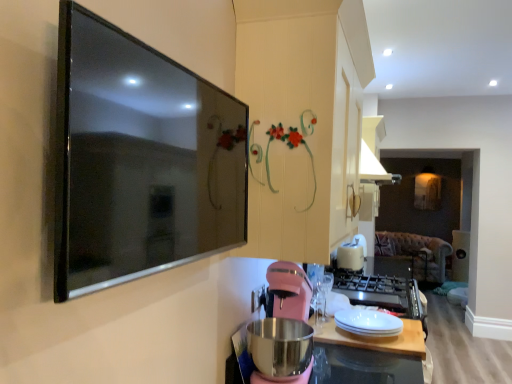
Question: Is pink matte blender at lower center positioned behind black glossy tv at upper left?

Choices:
 (A) no
 (B) yes

Answer: (B)

Question: Does pink matte blender at lower center appear on the right side of black glossy tv at upper left?

Choices:
 (A) no
 (B) yes

Answer: (B)

Question: From the image's perspective, does pink matte blender at lower center appear higher than black glossy tv at upper left?

Choices:
 (A) no
 (B) yes

Answer: (A)

Question: Does pink matte blender at lower center contain black glossy tv at upper left?

Choices:
 (A) no
 (B) yes

Answer: (A)

Question: From a real-world perspective, is pink matte blender at lower center under black glossy tv at upper left?

Choices:
 (A) yes
 (B) no

Answer: (A)

Question: Considering the positions of point (380, 344) and point (355, 322), is point (380, 344) closer or farther from the camera than point (355, 322)?

Choices:
 (A) farther
 (B) closer

Answer: (B)

Question: From the image's perspective, is white matte wood at center positioned above or below white glossy plate at center?

Choices:
 (A) above
 (B) below

Answer: (B)

Question: Considering their positions, is white matte wood at center located in front of or behind white glossy plate at center?

Choices:
 (A) behind
 (B) front

Answer: (B)

Question: Considering the relative positions of white matte wood at center and white glossy plate at center in the image provided, is white matte wood at center to the left or to the right of white glossy plate at center?

Choices:
 (A) left
 (B) right

Answer: (B)

Question: From the image's perspective, is metallic stainless steel at lower center located above or below white plastic toaster at upper center?

Choices:
 (A) above
 (B) below

Answer: (B)

Question: Considering the positions of metallic stainless steel at lower center and white plastic toaster at upper center in the image, is metallic stainless steel at lower center bigger or smaller than white plastic toaster at upper center?

Choices:
 (A) small
 (B) big

Answer: (B)

Question: In the image, is metallic stainless steel at lower center on the left side or the right side of white plastic toaster at upper center?

Choices:
 (A) left
 (B) right

Answer: (A)

Question: Considering their positions, is metallic stainless steel at lower center located in front of or behind white plastic toaster at upper center?

Choices:
 (A) behind
 (B) front

Answer: (B)

Question: Is pink matte blender at lower center wider or thinner than white glossy plate at center?

Choices:
 (A) thin
 (B) wide

Answer: (B)

Question: Considering the positions of pink matte blender at lower center and white glossy plate at center in the image, is pink matte blender at lower center taller or shorter than white glossy plate at center?

Choices:
 (A) short
 (B) tall

Answer: (B)